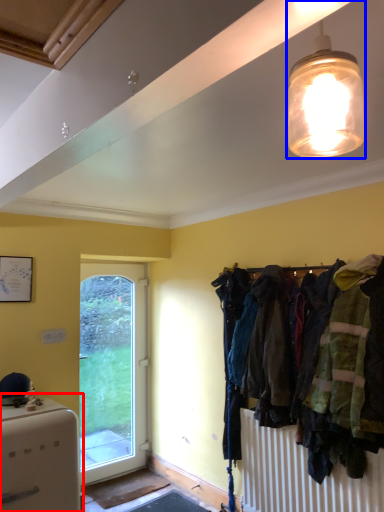
Question: Which object appears farthest to the camera in this image, appliance (highlighted by a red box) or lamp (highlighted by a blue box)?

Choices:
 (A) appliance
 (B) lamp

Answer: (A)